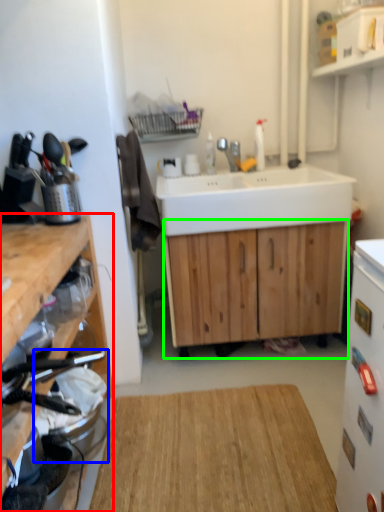
Question: Which object is positioned farthest from cabinetry (highlighted by a red box)? Select from appliance (highlighted by a blue box) and cabinetry (highlighted by a green box).

Choices:
 (A) appliance
 (B) cabinetry

Answer: (B)